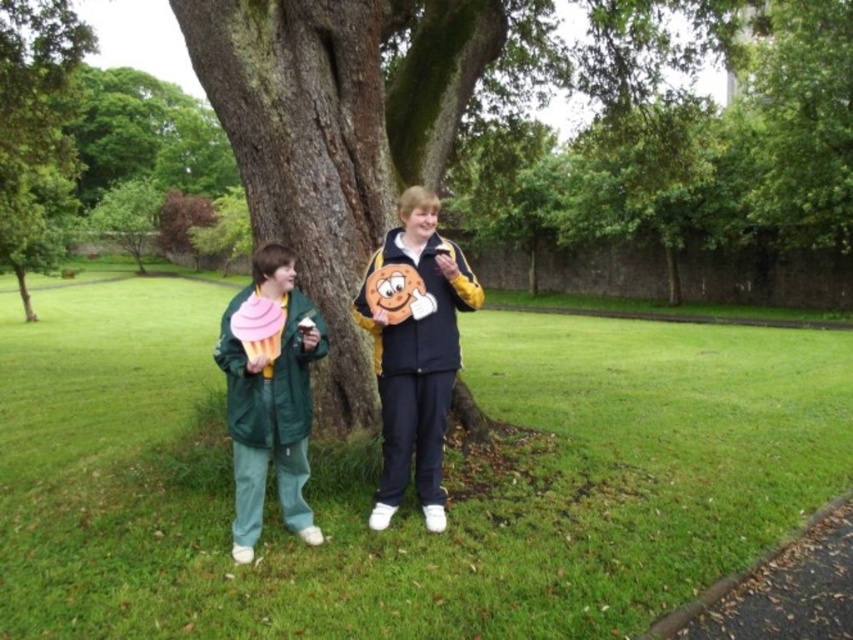
You are a photographer standing at the edge of the paved path on the right. You want to take a photo of the matte yellow jacket at center and the green leafy tree at center so that both are clearly visible in the frame. Given that your camera has a maximum focus range of 12 meters, will you be able to capture both subjects in focus?

The matte yellow jacket at center and green leafy tree at center are 12.89 meters apart from each other. Since the camera can only focus up to 12 meters, the distance between them exceeds the focus range. Therefore, you cannot capture both subjects in focus at the same time.

You are standing at point [276,385] and want to walk to point [682,556]. Which direction should you move in relation to the paved path on the right side of the frame?

You should move away from the paved path on the right side of the frame because point [682,556] is behind point [276,385], meaning it is located further back from the path.